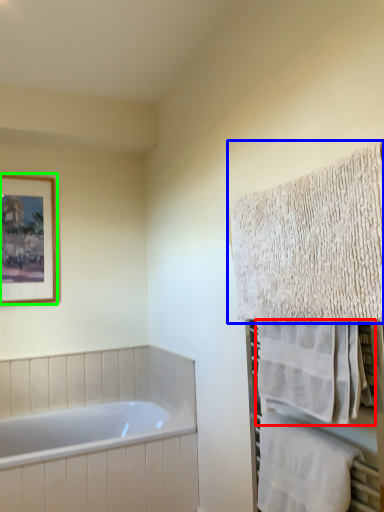
Question: Which object is positioned closest to towel (highlighted by a red box)? Select from towel (highlighted by a blue box) and picture frame (highlighted by a green box).

Choices:
 (A) towel
 (B) picture frame

Answer: (A)